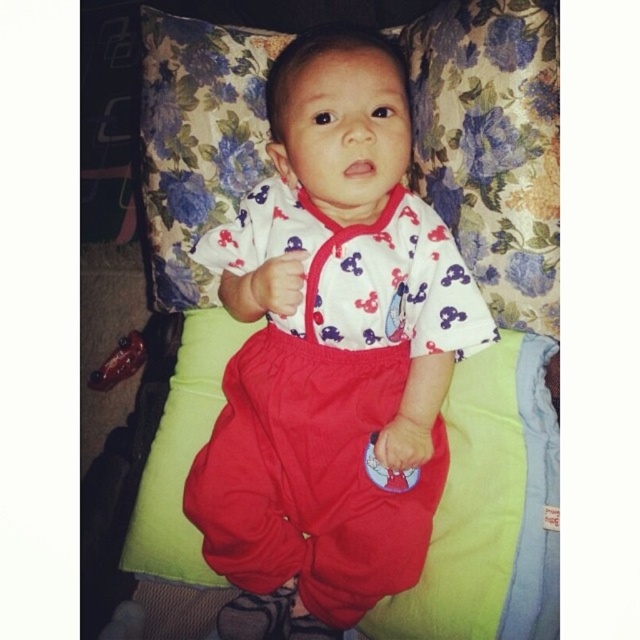
You are a parent holding a small toy that needs to be placed between the matte cotton baby at center and the floral fabric pillow at upper center. Given the space between them is exactly 8.31 inches, what is the maximum length the toy can be to fit without touching either object?

The maximum length the toy can be is 8.31 inches minus twice the required clearance from each object. However, since the question does not specify a clearance distance, the toy must be shorter than 8.31 inches to fit between the matte cotton baby at center and the floral fabric pillow at upper center without touching either.

You are a photographer adjusting the camera to capture the baby and the pillow in the scene. Since the camera can only focus on objects within a 50cm width range, will the matte cotton baby at center and the floral fabric pillow at upper center fit within this range if they are positioned side by side?

The matte cotton baby at center has a lesser width compared to the floral fabric pillow at upper center. However, without knowing the exact widths of both objects, we cannot determine if their combined width exceeds 50cm. Additional measurements are needed to confirm.

You are a photographer setting up a shoot for a baby photo session. You have a matte cotton baby at center and a floral fabric pillow at upper center in the scene. To ensure the baby stays comfortable and safe, you need to position the pillow so it doesn not obstruct the baby s face. Based on their current positions, is the pillow currently blocking the baby s face?

The matte cotton baby at center is located below the floral fabric pillow at upper center, so the pillow is positioned above the baby. This means the pillow is not blocking the baby s face as it is placed higher up.